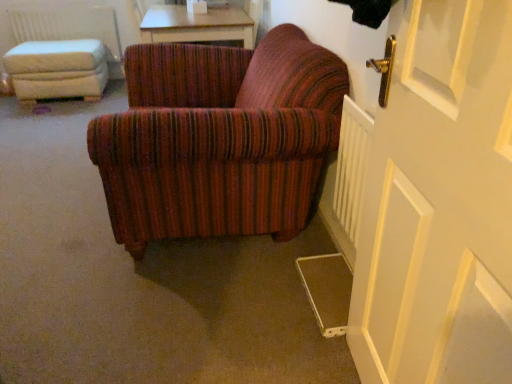
Question: Is white wooden door at right spatially inside white plastic radiator at lower right, which is the 2th radiator in top-to-bottom order, or outside of it?

Choices:
 (A) outside
 (B) inside

Answer: (A)

Question: Is white wooden door at right wider or thinner than white plastic radiator at lower right, marked as the second radiator in a back-to-front arrangement?

Choices:
 (A) thin
 (B) wide

Answer: (B)

Question: Based on their relative distances, which object is nearer to the light brown wooden table at upper center?

Choices:
 (A) white wooden door at right
 (B) white plastic radiator at lower right, marked as the second radiator in a back-to-front arrangement
 (C) white fabric radiator at upper left, which is the 2th radiator from right to left
 (D) white fabric ottoman at left

Answer: (D)

Question: Estimate the real-world distances between objects in this image. Which object is closer to the white wooden door at right?

Choices:
 (A) white plastic radiator at lower right, which appears as the 1th radiator when ordered from the bottom
 (B) white fabric ottoman at left
 (C) white fabric radiator at upper left, the 1th radiator from the back
 (D) light brown wooden table at upper center

Answer: (A)